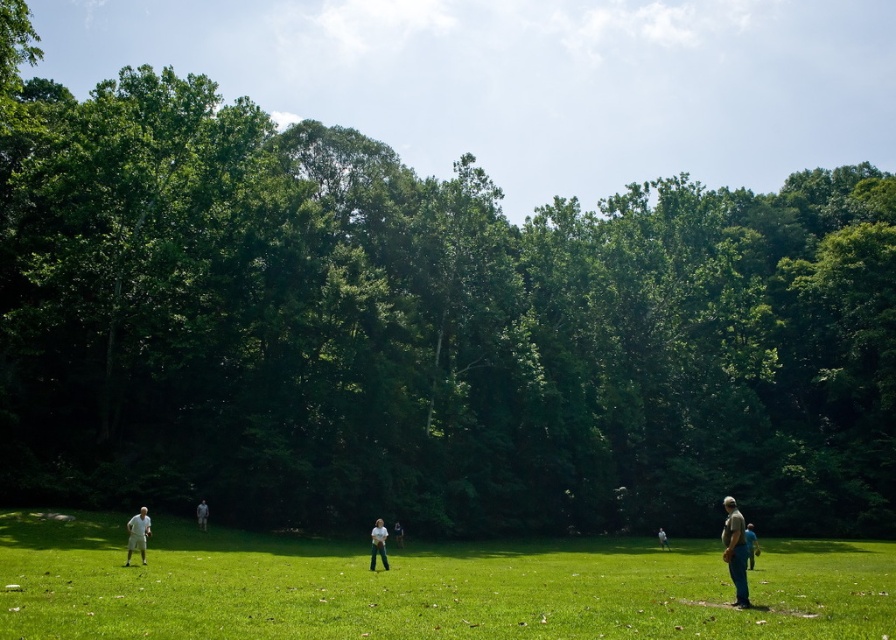
You are organizing a picnic and need to decide which shirt to use as a makeshift tablecloth. You have a white fabric shirt at center and a white cotton shirt at lower right. Which shirt has a larger surface area to cover the picnic basket?

The white cotton shirt at lower right has a larger surface area because its width is greater than the white fabric shirt at center.

You are standing in the park looking at the grassy field. There are two points marked on the field. The first point is at coordinates point (104,545) and the second point is at point (662,541). Which point is closer to you?

Point (104,545) is closer to the viewer than point (662,541).